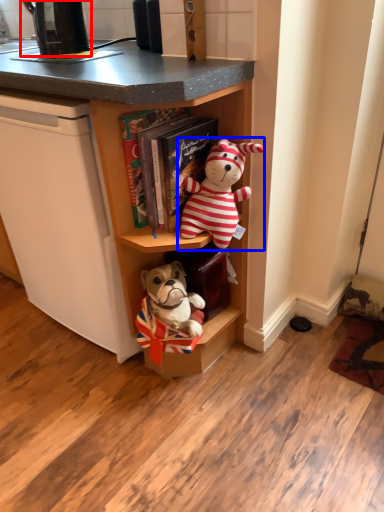
Question: Which point is closer to the camera, appliance (highlighted by a red box) or toy (highlighted by a blue box)?

Choices:
 (A) appliance
 (B) toy

Answer: (B)